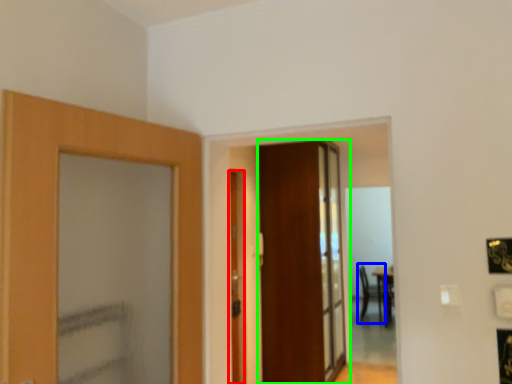
Question: Which object is positioned closest to door (highlighted by a red box)? Select from armchair (highlighted by a blue box) and door (highlighted by a green box).

Choices:
 (A) armchair
 (B) door

Answer: (B)